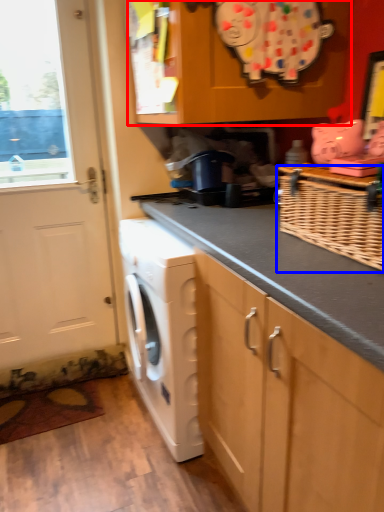
Question: Which object appears farthest to the camera in this image, cabinetry (highlighted by a red box) or basket (highlighted by a blue box)?

Choices:
 (A) cabinetry
 (B) basket

Answer: (A)